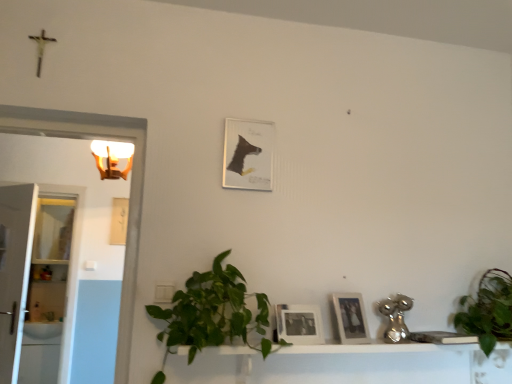
How much space does wooden photo frame at lower center, arranged as the third picture frame when viewed from the back, occupy horizontally?

1.45 inches.

Describe the element at coordinates (298, 324) in the screenshot. I see `matte black photo frame at center, which appears as the 3th picture frame when viewed from the left` at that location.

Measure the distance between white glossy sink at left and camera.

They are 4.10 meters apart.

What do you see at coordinates (14, 271) in the screenshot? I see `white glossy glass door at left, placed as the 1th glass door when sorted from front to back` at bounding box center [14, 271].

At what (x,y) coordinates should I click in order to perform the action: click on green leafy plant at lower center, which is counted as the 1th houseplant, starting from the left. Please return your answer as a coordinate pair (x, y). This screenshot has width=512, height=384. Looking at the image, I should click on (211, 313).

In order to click on matte paper picture frame at center, arranged as the third picture frame when viewed from the right in this screenshot , I will do `click(248, 154)`.

Which is correct: white glossy glass door at left, placed as the 1th glass door when sorted from front to back, is inside green leafy plant at lower right, the 2th houseplant from the left, or outside of it?

white glossy glass door at left, placed as the 1th glass door when sorted from front to back, lies outside green leafy plant at lower right, the 2th houseplant from the left.

Consider the image. Based on their positions, is white glossy glass door at left, placed as the 1th glass door when sorted from front to back, located to the left or right of green leafy plant at lower right, the 2th houseplant from the left?

In the image, white glossy glass door at left, placed as the 1th glass door when sorted from front to back, appears on the left side of green leafy plant at lower right, the 2th houseplant from the left.

Starting from the green leafy plant at lower right, the 2th houseplant from the left, which glass door is the 1st one behind? Please provide its 2D coordinates.

[(14, 271)]

Who is shorter, white glossy glass door at left, placed as the 1th glass door when sorted from front to back, or green leafy plant at lower right, the 1th houseplant viewed from the right?

green leafy plant at lower right, the 1th houseplant viewed from the right.

Where is `picture frame that is the 1st one when counting forward from the matte paper picture frame at center, arranged as the second picture frame when viewed from the left`? The image size is (512, 384). picture frame that is the 1st one when counting forward from the matte paper picture frame at center, arranged as the second picture frame when viewed from the left is located at coordinates [x=351, y=318].

Is wooden photo frame at lower center, arranged as the third picture frame when viewed from the back, in contact with matte paper picture frame at center, the first picture frame when ordered from top to bottom?

No, wooden photo frame at lower center, arranged as the third picture frame when viewed from the back, is not next to matte paper picture frame at center, the first picture frame when ordered from top to bottom.

Can we say wooden photo frame at lower center, arranged as the third picture frame when viewed from the back, lies outside matte paper picture frame at center, the 3th picture frame positioned from the front?

wooden photo frame at lower center, arranged as the third picture frame when viewed from the back, lies outside matte paper picture frame at center, the 3th picture frame positioned from the front,'s area.

Is matte black photo frame at center, the fourth picture frame in the top-to-bottom sequence, next to wooden photo frame at lower center, which is the 2th picture frame in front-to-back order?

matte black photo frame at center, the fourth picture frame in the top-to-bottom sequence, is not next to wooden photo frame at lower center, which is the 2th picture frame in front-to-back order, and they're not touching.

Which object is closer to the camera taking this photo, matte black photo frame at center, placed as the first picture frame when sorted from bottom to top, or wooden photo frame at lower center, arranged as the 3th picture frame when viewed from the top?

matte black photo frame at center, placed as the first picture frame when sorted from bottom to top, is more forward.

Is matte black photo frame at center, which appears as the 3th picture frame when viewed from the left, shorter than wooden photo frame at lower center, placed as the 2th picture frame when sorted from bottom to top?

Yes, matte black photo frame at center, which appears as the 3th picture frame when viewed from the left, is shorter than wooden photo frame at lower center, placed as the 2th picture frame when sorted from bottom to top.

Considering the positions of points (319, 319) and (364, 322), is point (319, 319) farther from camera compared to point (364, 322)?

No, it is in front of (364, 322).

Is point (30, 323) positioned behind point (122, 154)?

Yes, point (30, 323) is farther from viewer.

Which object is closer to the camera, white glossy sink at left or white glossy light fixture at upper left?

white glossy light fixture at upper left is more forward.

From a real-world perspective, is white glossy sink at left positioned above or below white glossy light fixture at upper left?

Clearly, from a real-world perspective, white glossy sink at left is below white glossy light fixture at upper left.

Is white glossy light fixture at upper left inside the boundaries of matte black photo frame at center, positioned as the 4th picture frame in back-to-front order, or outside?

white glossy light fixture at upper left is located beyond the bounds of matte black photo frame at center, positioned as the 4th picture frame in back-to-front order.

Can you confirm if white glossy light fixture at upper left is bigger than matte black photo frame at center, the first picture frame from the front?

Correct, white glossy light fixture at upper left is larger in size than matte black photo frame at center, the first picture frame from the front.

Is point (120, 149) in front of point (313, 341)?

No, it is not.

How many degrees apart are the facing directions of white glossy vanity at lower center and white glossy sink at left?

white glossy vanity at lower center and white glossy sink at left are facing 8.91 degrees away from each other.

The width and height of the screenshot is (512, 384). In order to click on vanity located above the white glossy sink at left (from the image's perspective) in this screenshot , I will do `click(367, 363)`.

Which point is more forward, (x=510, y=358) or (x=34, y=335)?

Positioned in front is point (x=510, y=358).

Can you confirm if white glossy vanity at lower center is wider than white glossy sink at left?

No, white glossy vanity at lower center is not wider than white glossy sink at left.

Would you consider white glossy cabinet at left, positioned as the first glass door in back-to-front order, to be distant from white glossy glass door at left, placed as the 1th glass door when sorted from front to back?

Absolutely, white glossy cabinet at left, positioned as the first glass door in back-to-front order, is distant from white glossy glass door at left, placed as the 1th glass door when sorted from front to back.

Which object is thinner, white glossy cabinet at left, positioned as the first glass door in back-to-front order, or white glossy glass door at left, placed as the 1th glass door when sorted from front to back?

white glossy cabinet at left, positioned as the first glass door in back-to-front order, is thinner.

From the image's perspective, is white glossy cabinet at left, positioned as the first glass door in back-to-front order, on top of white glossy glass door at left, which is the second glass door from back to front?

No, from the image's perspective, white glossy cabinet at left, positioned as the first glass door in back-to-front order, is not over white glossy glass door at left, which is the second glass door from back to front.

Which point is more distant from viewer, (58, 226) or (8, 289)?

Positioned behind is point (58, 226).

Locate an element on the screen. houseplant that is the 1st object located in front of the white glossy glass door at left, placed as the 1th glass door when sorted from front to back is located at coordinates (488, 310).

From the image's perspective, starting from the matte paper picture frame at center, the 2th picture frame from the back, which picture frame is the 2nd one below? Please provide its 2D coordinates.

[(351, 318)]

When comparing their distances from white glossy glass door at left, which is the second glass door from back to front, does white glossy vanity at lower center or white glossy cabinet at left, positioned as the first glass door in back-to-front order, seem closer?

Based on the image, white glossy cabinet at left, positioned as the first glass door in back-to-front order, appears to be nearer to white glossy glass door at left, which is the second glass door from back to front.

From the image, which object appears to be nearer to white glossy sink at left, white glossy cabinet at left, which appears as the second glass door when viewed from the front, or white glossy light fixture at upper left?

Based on the image, white glossy cabinet at left, which appears as the second glass door when viewed from the front, appears to be nearer to white glossy sink at left.

Based on their spatial positions, is white glossy light fixture at upper left or green leafy plant at lower right, the 1th houseplant viewed from the right, further from matte paper picture frame at center, the first picture frame when ordered from top to bottom?

green leafy plant at lower right, the 1th houseplant viewed from the right.

Considering their positions, is green leafy plant at lower right, the 2th houseplant from the left, positioned further to matte black photo frame at center, the first picture frame from the front, than wooden photo frame at lower center, arranged as the 3th picture frame when viewed from the top?

The object further to matte black photo frame at center, the first picture frame from the front, is green leafy plant at lower right, the 2th houseplant from the left.

Based on the photo, which object lies further to the anchor point white glossy light fixture at upper left, white glossy vanity at lower center or matte paper picture frame at center, the 3th picture frame positioned from the front?

Among the two, white glossy vanity at lower center is located further to white glossy light fixture at upper left.

Looking at the image, which one is located closer to white glossy vanity at lower center, matte paper picture frame at center, the first picture frame when ordered from top to bottom, or matte black photo frame at center, positioned as the 4th picture frame in back-to-front order?

matte black photo frame at center, positioned as the 4th picture frame in back-to-front order, lies closer to white glossy vanity at lower center than the other object.

Consider the image. From the image, which object appears to be farther from matte black photo frame at center, positioned as the 4th picture frame in back-to-front order, wooden picture frame at left, the first picture frame in the left-to-right sequence, or wooden photo frame at lower center, the fourth picture frame positioned from the left?

wooden picture frame at left, the first picture frame in the left-to-right sequence, is further to matte black photo frame at center, positioned as the 4th picture frame in back-to-front order.

Based on their spatial positions, is wooden picture frame at left, which ranks as the third picture frame in bottom-to-top order, or white glossy cabinet at left, positioned as the first glass door in back-to-front order, further from wooden photo frame at lower center, placed as the 1th picture frame when sorted from right to left?

Based on the image, white glossy cabinet at left, positioned as the first glass door in back-to-front order, appears to be further to wooden photo frame at lower center, placed as the 1th picture frame when sorted from right to left.

You are a GUI agent. You are given a task and a screenshot of the screen. Output one action in this format:
    pyautogui.click(x=<x>, y=<y>)
    Task: Click on the light fixture between matte black photo frame at center, which is counted as the second picture frame, starting from the right, and white glossy sink at left, along the z-axis
    The width and height of the screenshot is (512, 384).
    Given the screenshot: What is the action you would take?
    pyautogui.click(x=112, y=158)

Locate an element on the screen. light fixture between white glossy glass door at left, which is the second glass door from back to front, and matte paper picture frame at center, the fourth picture frame when ordered from bottom to top, from left to right is located at coordinates (112, 158).

Image resolution: width=512 pixels, height=384 pixels. What are the coordinates of `light fixture between green leafy plant at lower center, which is counted as the 1th houseplant, starting from the left, and wooden picture frame at left, the 2th picture frame in the top-to-bottom sequence, from front to back` in the screenshot? It's located at (112, 158).

This screenshot has width=512, height=384. Find the location of `light fixture located between wooden photo frame at lower center, the fourth picture frame positioned from the left, and wooden picture frame at left, which ranks as the third picture frame in bottom-to-top order, in the depth direction`. light fixture located between wooden photo frame at lower center, the fourth picture frame positioned from the left, and wooden picture frame at left, which ranks as the third picture frame in bottom-to-top order, in the depth direction is located at coordinates (112, 158).